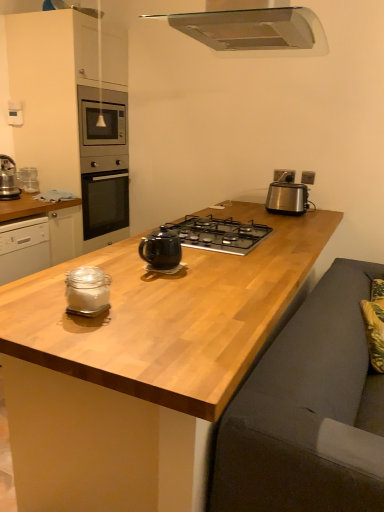
Question: Does metallic stainless steel range hood at upper center have a greater width compared to wooden at center?

Choices:
 (A) yes
 (B) no

Answer: (B)

Question: Is metallic stainless steel range hood at upper center aimed at wooden at center?

Choices:
 (A) no
 (B) yes

Answer: (A)

Question: From a real-world perspective, is metallic stainless steel range hood at upper center on top of wooden at center?

Choices:
 (A) yes
 (B) no

Answer: (A)

Question: From the image's perspective, is metallic stainless steel range hood at upper center over wooden at center?

Choices:
 (A) no
 (B) yes

Answer: (B)

Question: From a real-world perspective, is metallic stainless steel range hood at upper center positioned under wooden at center based on gravity?

Choices:
 (A) yes
 (B) no

Answer: (B)

Question: Choose the correct answer: Is satin silver toaster at right inside matte gray cabinetry at upper left, the 2th cabinetry from the bottom, or outside it?

Choices:
 (A) outside
 (B) inside

Answer: (A)

Question: In the image, is satin silver toaster at right on the left side or the right side of matte gray cabinetry at upper left, the 1th cabinetry positioned from the top?

Choices:
 (A) left
 (B) right

Answer: (B)

Question: From a real-world perspective, is satin silver toaster at right physically located above or below matte gray cabinetry at upper left, the 1th cabinetry positioned from the top?

Choices:
 (A) below
 (B) above

Answer: (A)

Question: From the image's perspective, is satin silver toaster at right located above or below matte gray cabinetry at upper left, the 2th cabinetry from the bottom?

Choices:
 (A) above
 (B) below

Answer: (B)

Question: Is satin silver toaster at right to the left or to the right of clear glass jar at left, which appears as the 1th cabinetry when ordered from the bottom, in the image?

Choices:
 (A) left
 (B) right

Answer: (B)

Question: Relative to clear glass jar at left, which appears as the 1th cabinetry when ordered from the bottom, is satin silver toaster at right in front or behind?

Choices:
 (A) front
 (B) behind

Answer: (B)

Question: From the image's perspective, is satin silver toaster at right above or below clear glass jar at left, the second cabinetry in the top-to-bottom sequence?

Choices:
 (A) above
 (B) below

Answer: (A)

Question: Is point (299, 199) positioned closer to the camera than point (8, 202)?

Choices:
 (A) closer
 (B) farther

Answer: (B)

Question: In terms of width, does satin silver toaster at right look wider or thinner when compared to wooden at center?

Choices:
 (A) wide
 (B) thin

Answer: (B)

Question: Considering their positions, is satin silver toaster at right located in front of or behind wooden at center?

Choices:
 (A) behind
 (B) front

Answer: (A)